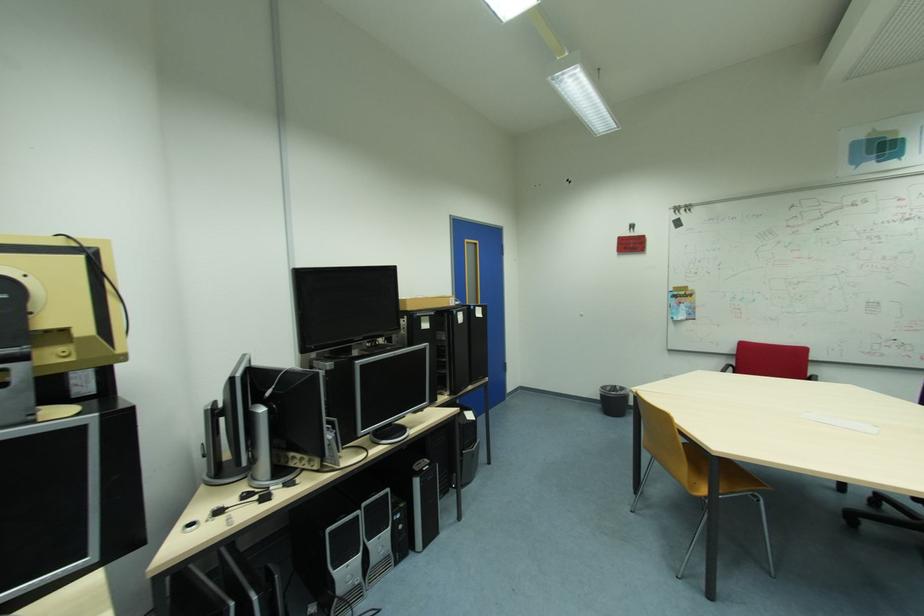
Identify the location of blue door handle. The width and height of the screenshot is (924, 616). (465, 252).